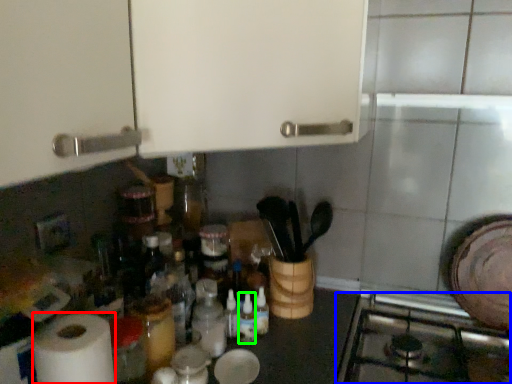
Question: Estimate the real-world distances between objects in this image. Which object is farther from paper towel (highlighted by a red box), gas stove (highlighted by a blue box) or bottle (highlighted by a green box)?

Choices:
 (A) gas stove
 (B) bottle

Answer: (A)